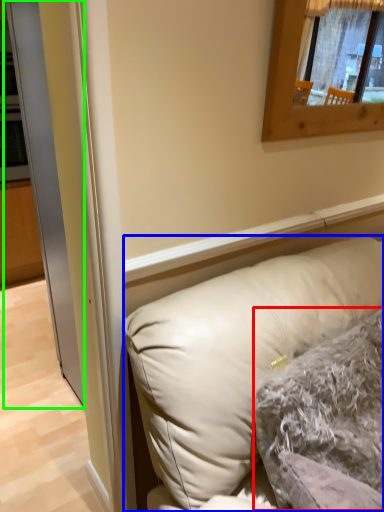
Question: Which object is the closest to the pillow (highlighted by a red box)? Choose among these: pillow (highlighted by a blue box) or glass door (highlighted by a green box).

Choices:
 (A) pillow
 (B) glass door

Answer: (A)